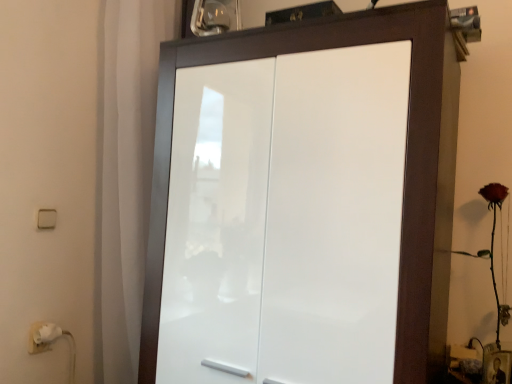
Question: From a real-world perspective, is white plastic light switch at left above or below white glossy cupboard at center?

Choices:
 (A) above
 (B) below

Answer: (A)

Question: Is white plastic light switch at left in front of or behind white glossy cupboard at center in the image?

Choices:
 (A) front
 (B) behind

Answer: (B)

Question: Based on their relative distances, which object is farther from the white glossy cupboard at center?

Choices:
 (A) white plastic light switch at left
 (B) white matte curtain at left
 (C) matte red rose at right

Answer: (A)

Question: Which object is the farthest from the white matte curtain at left?

Choices:
 (A) white plastic light switch at left
 (B) matte red rose at right
 (C) white glossy cupboard at center

Answer: (B)